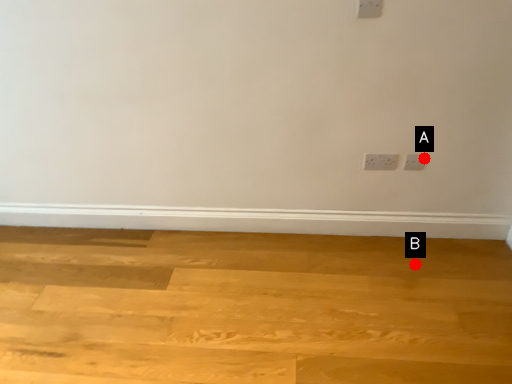
Question: Two points are circled on the image, labeled by A and B beside each circle. Which of the following is the closest to the observer?

Choices:
 (A) A is closer
 (B) B is closer

Answer: (A)